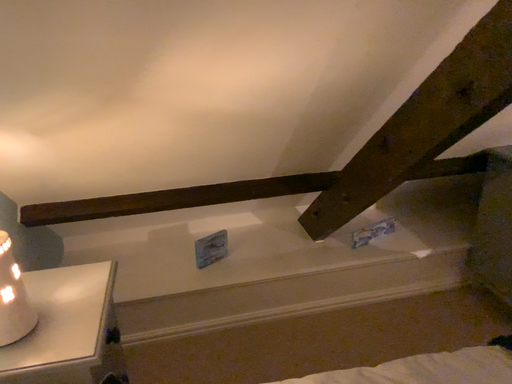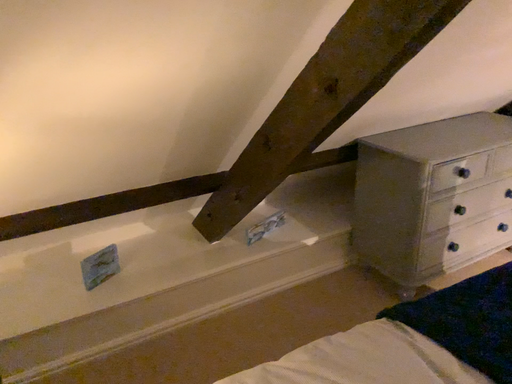
Question: Which way did the camera rotate in the video?

Choices:
 (A) rotated left
 (B) rotated right

Answer: (B)